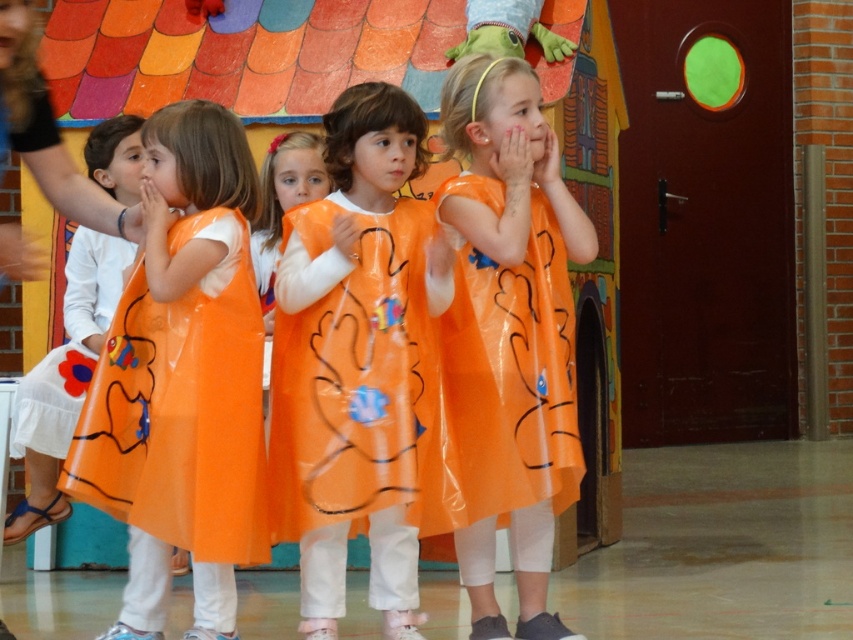
You are a photographer trying to capture a clear shot of both the transparent orange dress at center and the orange translucent dress at center. Since they are at the same location, which one will appear taller in the photo?

The transparent orange dress at center will appear taller in the photo because it is much taller than the orange translucent dress at center according to the description.